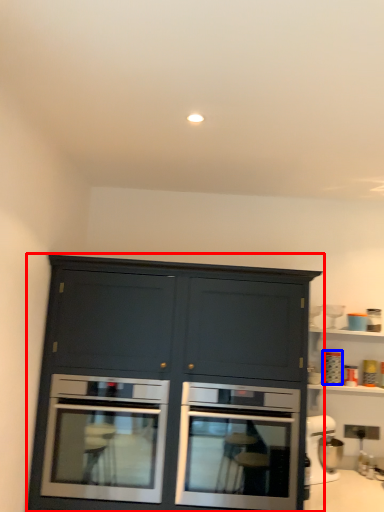
Question: Among these objects, which one is nearest to the camera, cabinetry (highlighted by a red box) or appliance (highlighted by a blue box)?

Choices:
 (A) cabinetry
 (B) appliance

Answer: (A)